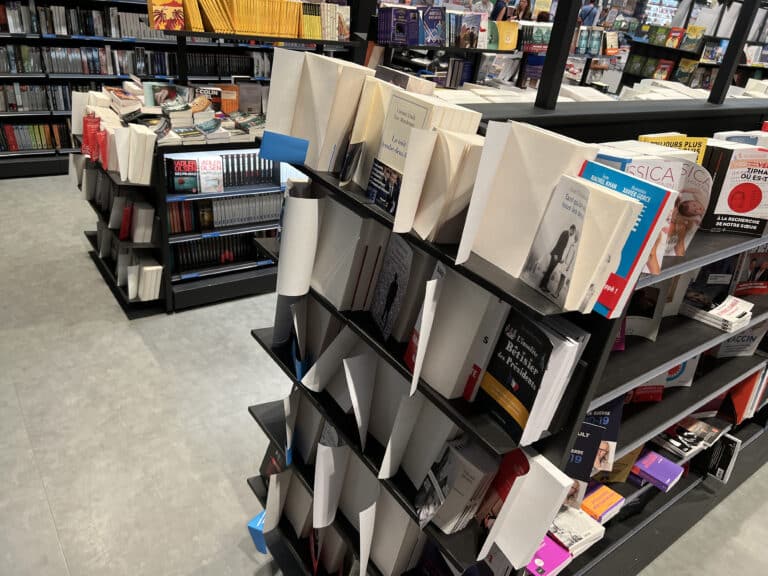
Identify the location of red book ends. (88, 126).